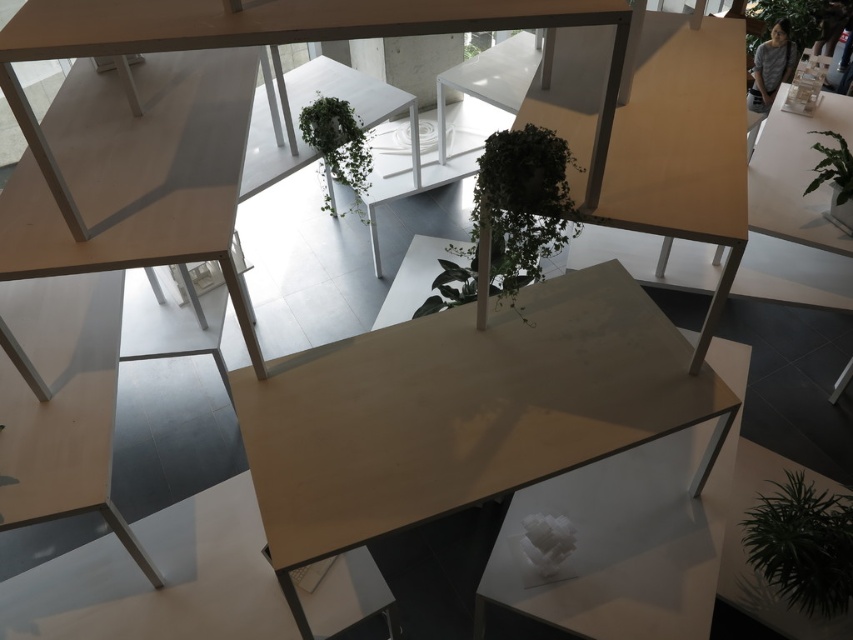
Question: Which of these objects is positioned farthest from the green leafy plant at upper right?

Choices:
 (A) matte wooden table at center
 (B) green matte plant at center
 (C) green leafy plant at right
 (D) green leafy plant at center

Answer: (A)

Question: Is matte wooden table at center bigger than green leafy plant at lower right?

Choices:
 (A) yes
 (B) no

Answer: (A)

Question: Which is farther from the matte wooden table at center?

Choices:
 (A) green leafy plant at right
 (B) green leafy plant at lower right
 (C) green leafy plant at center
 (D) green matte plant at center

Answer: (A)

Question: Is green leafy plant at center thinner than green leafy plant at upper right?

Choices:
 (A) no
 (B) yes

Answer: (B)

Question: Does green matte plant at center appear on the right side of green leafy plant at upper right?

Choices:
 (A) yes
 (B) no

Answer: (B)

Question: Which object appears closest to the camera in this image?

Choices:
 (A) matte wooden table at center
 (B) green leafy plant at center

Answer: (A)